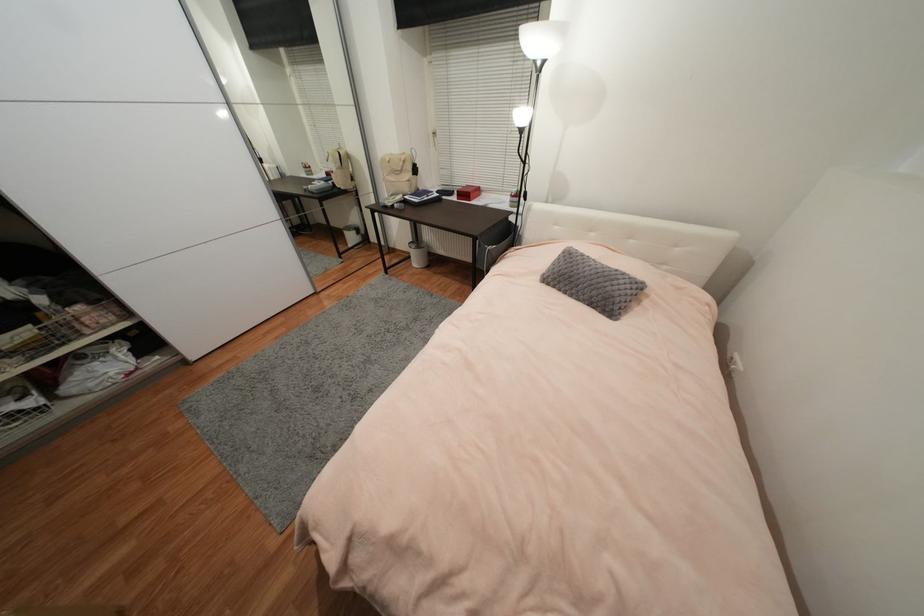
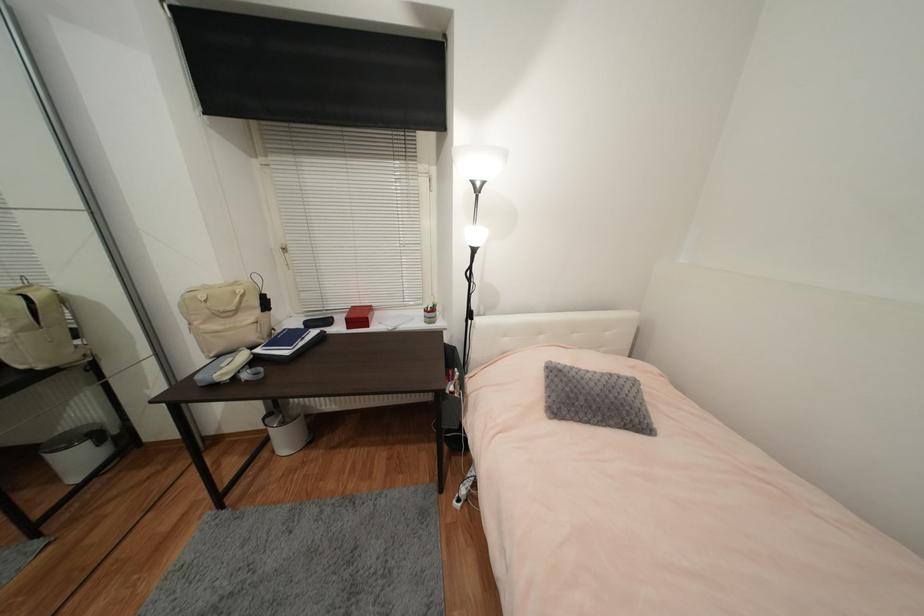
The point at [529,201] is marked in the first image. Where is the corresponding point in the second image?

(477, 320)